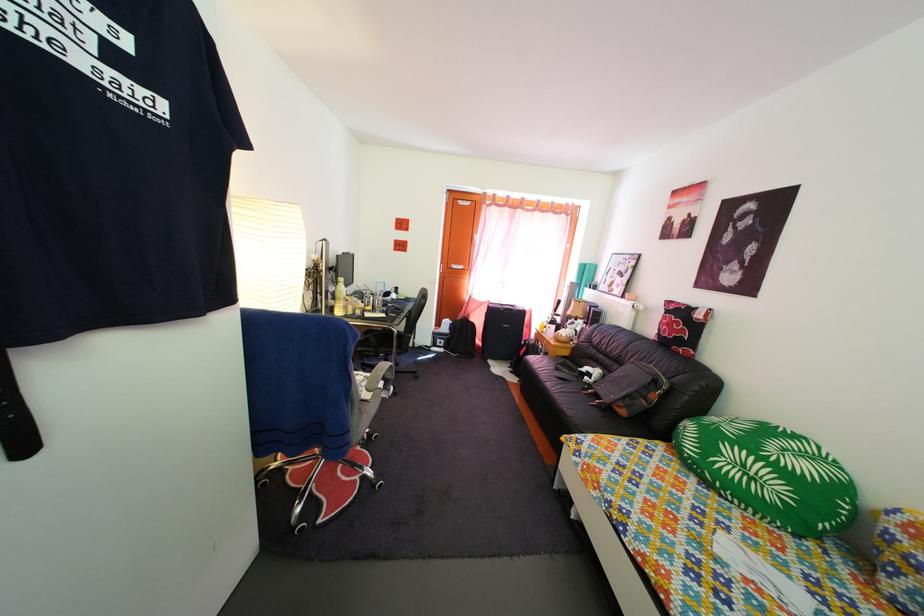
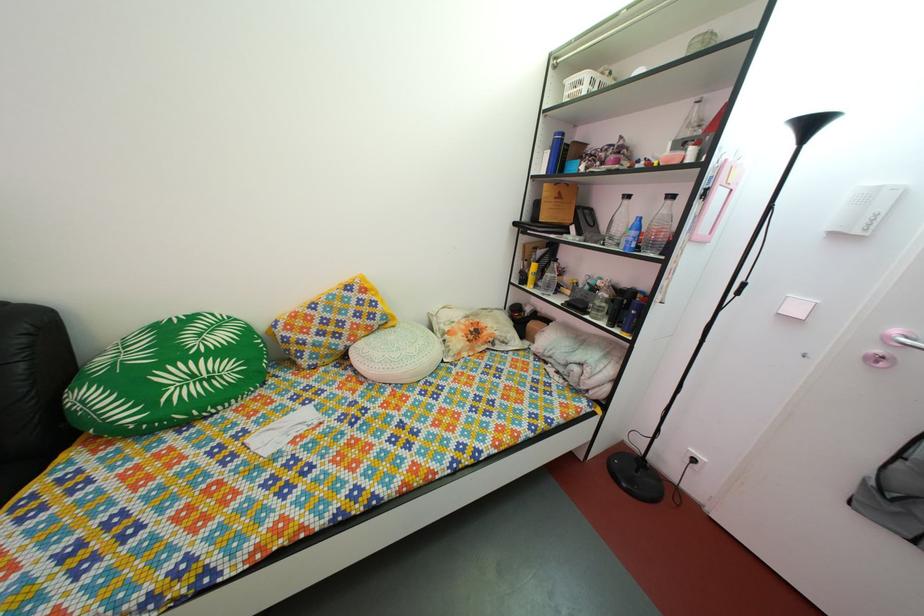
Find the pixel in the second image that matches point 762,487 in the first image.

(220, 387)